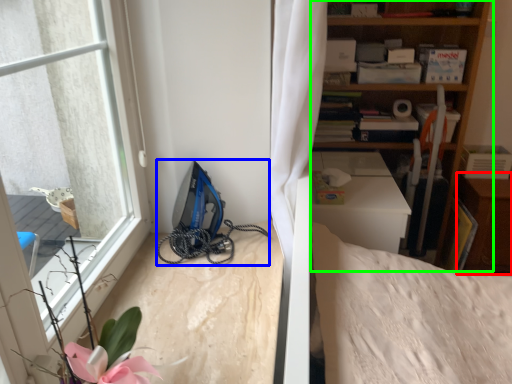
Question: Considering the real-world distances, which object is closest to dresser (highlighted by a red box)? equipment (highlighted by a blue box) or shelf (highlighted by a green box).

Choices:
 (A) equipment
 (B) shelf

Answer: (B)